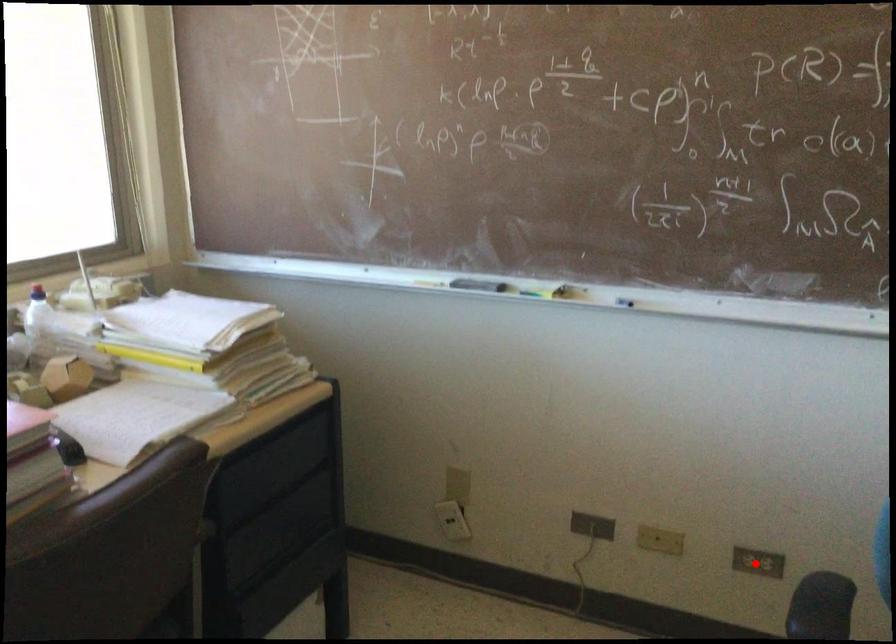
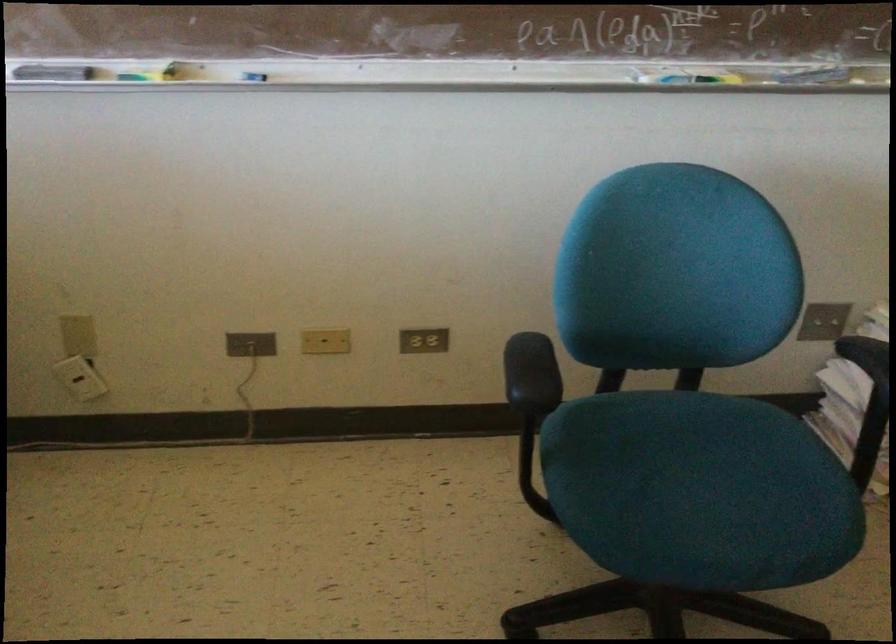
In the second image, find the point that corresponds to the highlighted location in the first image.

(423, 341)